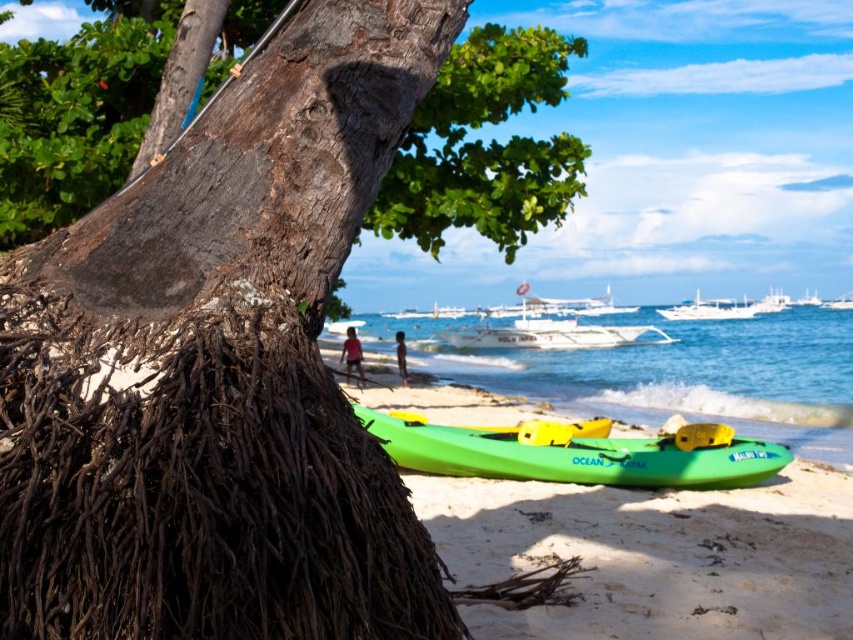
Question: Which point is closer to the camera?

Choices:
 (A) green plastic kayak at lower center
 (B) white glossy boat at upper center
 (C) brown rough bark tree at center

Answer: (C)

Question: Can you confirm if brown rough bark tree at center is positioned to the right of green plastic kayak at lower center?

Choices:
 (A) no
 (B) yes

Answer: (A)

Question: Is transparent blue water at center above green plastic kayak at lower center?

Choices:
 (A) no
 (B) yes

Answer: (B)

Question: Which of the following is the farthest from the observer?

Choices:
 (A) (561, 624)
 (B) (746, 305)

Answer: (B)

Question: Observing the image, what is the correct spatial positioning of green plastic kayak at center in reference to green plastic kayak at lower center?

Choices:
 (A) right
 (B) left

Answer: (A)

Question: Which object is closer to the camera taking this photo?

Choices:
 (A) brown rough bark tree at center
 (B) green plastic kayak at lower center
 (C) white glossy boat at upper center

Answer: (A)